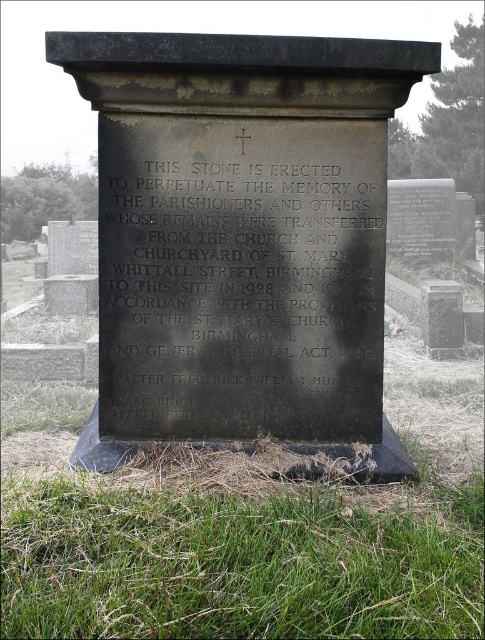
Consider the image. You are an archaeologist examining the site and need to determine which object is taller between the black stone monument at center and the black polished stone plaque at center. Based on the scene, which one is taller?

The black stone monument at center is taller than the black polished stone plaque at center.

Based on the photo, you are standing at the edge of the cemetery and see the black stone monument at center and the green grass at lower center. Which object is positioned higher in the image?

The black stone monument at center is located above the green grass at lower center, so it is positioned higher in the image.